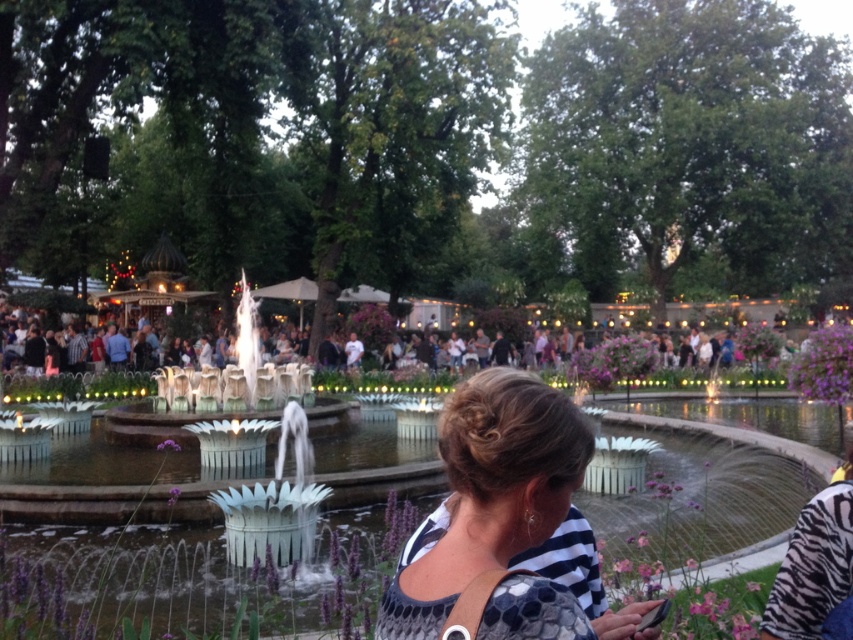
Consider the image. Which of these two, metallic fountain at center or purple matte flower at center, stands taller?

With more height is metallic fountain at center.

Who is positioned more to the right, metallic fountain at center or purple matte flower at center?

metallic fountain at center

The image size is (853, 640). Find the location of `metallic fountain at center`. metallic fountain at center is located at coordinates (698, 500).

The height and width of the screenshot is (640, 853). Find the location of `metallic fountain at center`. metallic fountain at center is located at coordinates (698, 500).

Measure the distance from metallic fountain at center to white dotted blouse at center.

metallic fountain at center is 5.14 meters from white dotted blouse at center.

Is point (212, 536) in front of point (556, 470)?

No.

Who is more distant from viewer, (140, 598) or (527, 600)?

Positioned behind is point (140, 598).

Find the location of a particular element. The width and height of the screenshot is (853, 640). metallic fountain at center is located at coordinates (698, 500).

Is metallic fountain at center wider than purple fabric flower at lower right?

Yes.

Between metallic fountain at center and purple fabric flower at lower right, which one appears on the left side from the viewer's perspective?

From the viewer's perspective, metallic fountain at center appears more on the left side.

Is point (762, 461) less distant than point (846, 330)?

That is True.

Find the location of a particular element. This screenshot has width=853, height=640. metallic fountain at center is located at coordinates (698, 500).